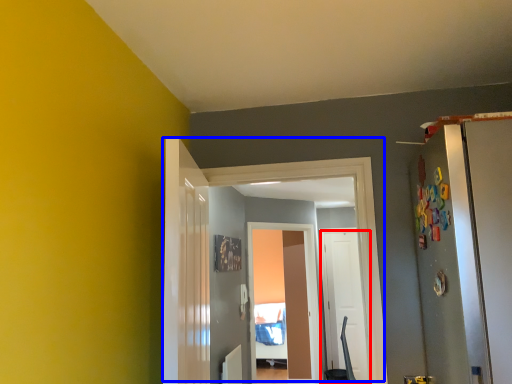
Question: Among these objects, which one is nearest to the camera, door (highlighted by a red box) or door (highlighted by a blue box)?

Choices:
 (A) door
 (B) door

Answer: (B)